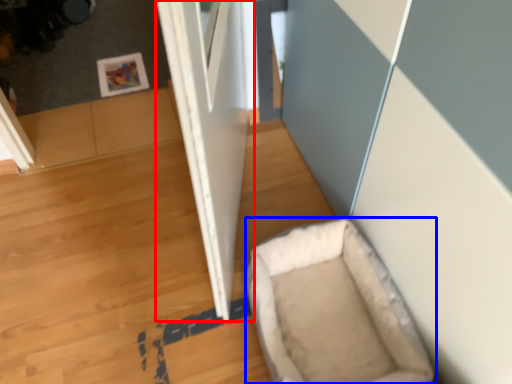
Question: Which point is further to the camera, door (highlighted by a red box) or dog bed (highlighted by a blue box)?

Choices:
 (A) door
 (B) dog bed

Answer: (B)